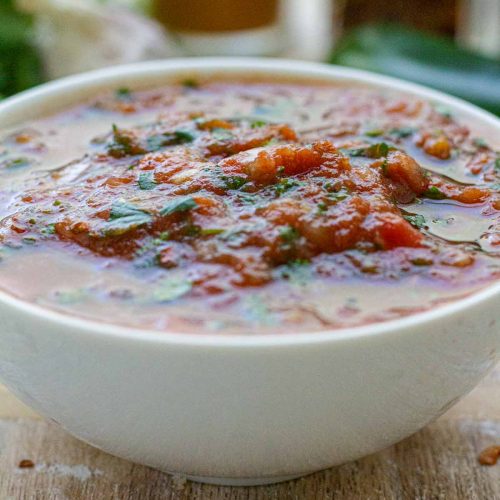
I want to click on white bowl, so click(x=225, y=424).